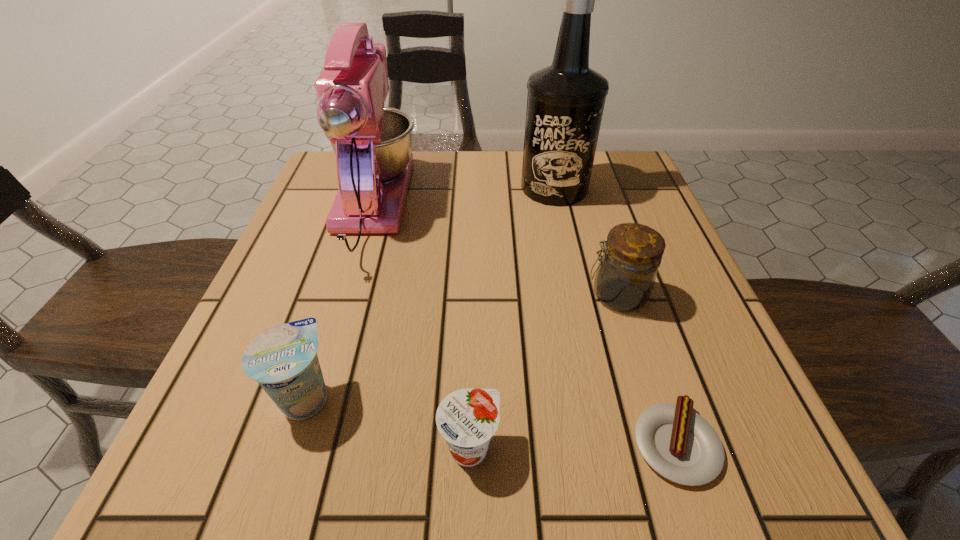
This screenshot has width=960, height=540. I want to click on liquor, so click(x=565, y=102).

At what (x,y) coordinates should I click in order to perform the action: click on the fifth shortest object. Please return your answer as a coordinate pair (x, y). Looking at the image, I should click on (372, 143).

Where is `jar`? This screenshot has width=960, height=540. jar is located at coordinates (625, 277).

Where is `the taller yogurt`? the taller yogurt is located at coordinates (283, 359).

Identify the location of the left yogurt. The height and width of the screenshot is (540, 960). (283, 359).

In order to click on the right yogurt in this screenshot , I will do `click(467, 419)`.

Where is `the second shortest object`? the second shortest object is located at coordinates (467, 419).

Where is `sausage`? The height and width of the screenshot is (540, 960). sausage is located at coordinates (679, 444).

Find the location of a particular element. This screenshot has width=960, height=540. vacant space positioned 0.140m on the front label of the tallest object is located at coordinates (567, 248).

Where is `free space located on the lid of the jar`? The image size is (960, 540). free space located on the lid of the jar is located at coordinates (389, 295).